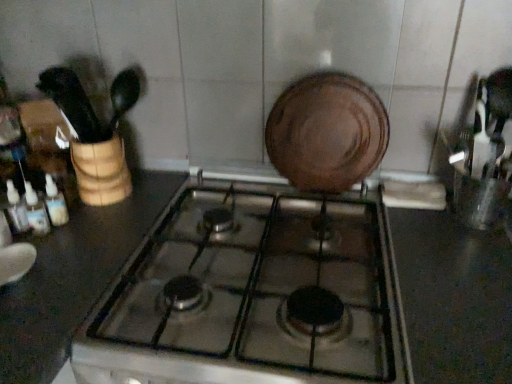
Question: From a real-world perspective, is translucent plastic bottles at left, which appears as the second bottle when viewed from the right, positioned above or below black glossy countertop at center?

Choices:
 (A) below
 (B) above

Answer: (B)

Question: Does point (28, 210) appear closer or farther from the camera than point (482, 246)?

Choices:
 (A) farther
 (B) closer

Answer: (A)

Question: Which object is the closest to the black glossy countertop at center?

Choices:
 (A) translucent plastic bottles at left, which is the third bottle from right to left
 (B) metallic glass gas stove at center
 (C) translucent plastic bottles at left, the 2th bottle positioned from the left
 (D) translucent plastic bottles at left, the 3th bottle when ordered from left to right
 (E) brown matte plate at center

Answer: (B)

Question: Estimate the real-world distances between objects in this image. Which object is closer to the translucent plastic bottles at left, the 1th bottle when ordered from left to right?

Choices:
 (A) translucent plastic bottles at left, the 3th bottle when ordered from left to right
 (B) metallic glass gas stove at center
 (C) brown matte plate at center
 (D) black glossy countertop at center
 (E) translucent plastic bottles at left, which appears as the second bottle when viewed from the right

Answer: (E)